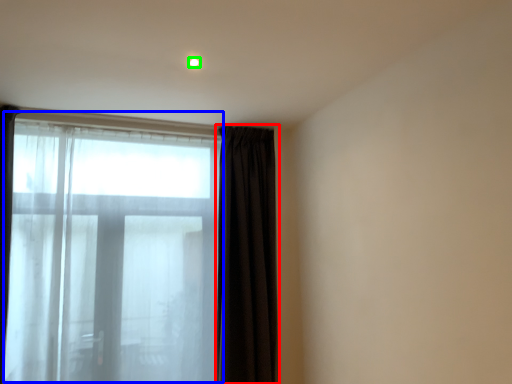
Question: Estimate the real-world distances between objects in this image. Which object is closer to curtain (highlighted by a red box), bay window (highlighted by a blue box) or light (highlighted by a green box)?

Choices:
 (A) bay window
 (B) light

Answer: (A)